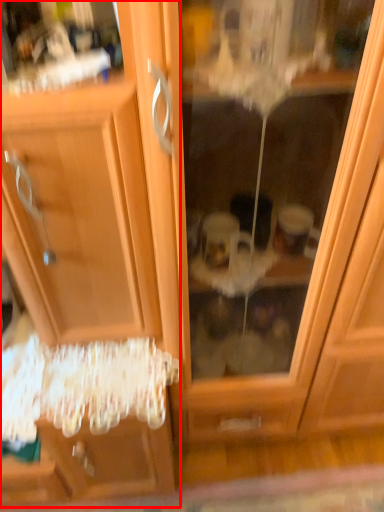
Question: In this image, where is dresser (annotated by the red box) located relative to screen door?

Choices:
 (A) left
 (B) right

Answer: (A)